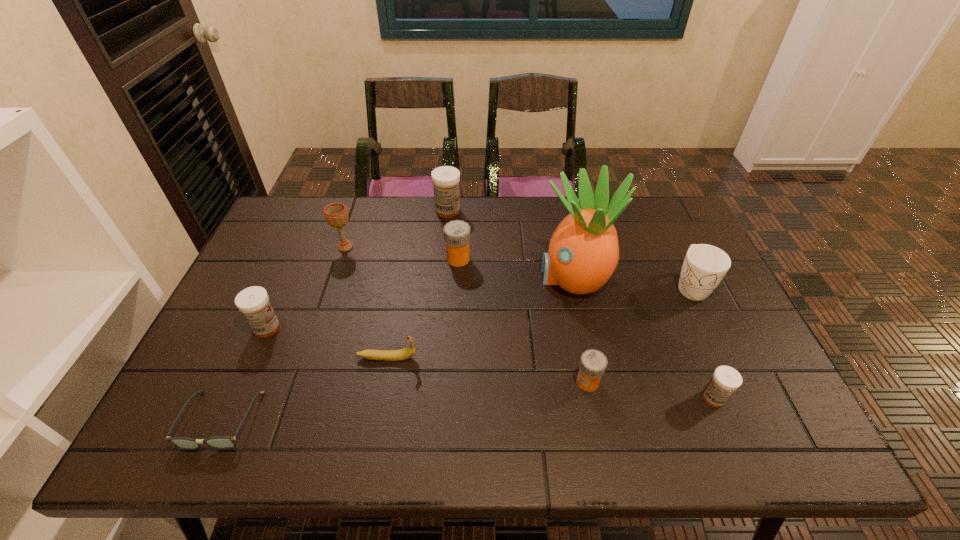
You are a GUI agent. You are given a task and a screenshot of the screen. Output one action in this format:
    pyautogui.click(x=<x>, y=<y>)
    Task: Click on the pineapple
    This screenshot has height=540, width=960.
    Given the screenshot: What is the action you would take?
    pyautogui.click(x=583, y=253)

Locate an element on the screen. The image size is (960, 540). orange pineapple is located at coordinates (583, 253).

What are the coordinates of `the biggest white medicine` in the screenshot? It's located at (445, 179).

This screenshot has width=960, height=540. Find the location of `the tallest medicine`. the tallest medicine is located at coordinates (445, 179).

At what (x,y) coordinates should I click in order to perform the action: click on beige chalice. Please return your answer as a coordinate pair (x, y). Image resolution: width=960 pixels, height=540 pixels. Looking at the image, I should click on (336, 214).

Where is `the third object from left to right`? The height and width of the screenshot is (540, 960). the third object from left to right is located at coordinates (336, 214).

Where is `mug`? mug is located at coordinates (704, 266).

In order to click on the fourth nearest medicine in this screenshot , I will do `click(457, 232)`.

Locate an element on the screen. The image size is (960, 540). the bigger orange medicine is located at coordinates (457, 232).

The height and width of the screenshot is (540, 960). Find the location of `the second smallest white medicine`. the second smallest white medicine is located at coordinates (253, 302).